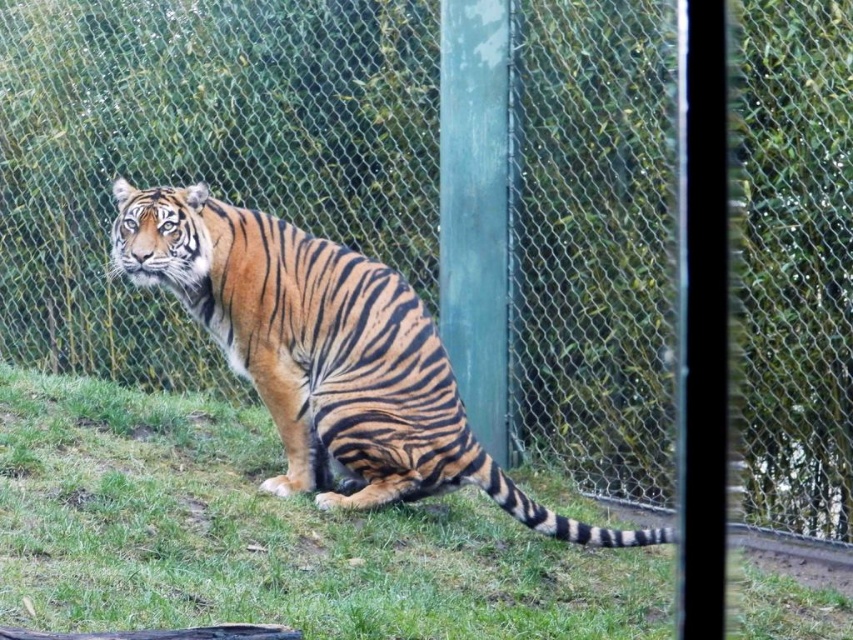
Question: Which point is farther from the camera taking this photo?

Choices:
 (A) (349, 413)
 (B) (276, 461)

Answer: (B)

Question: Is green grass at lower center closer to camera compared to orange-brown striped tiger at center?

Choices:
 (A) yes
 (B) no

Answer: (A)

Question: Considering the relative positions of green grass at lower center and orange-brown striped tiger at center in the image provided, where is green grass at lower center located with respect to orange-brown striped tiger at center?

Choices:
 (A) below
 (B) above

Answer: (A)

Question: Among these objects, which one is nearest to the camera?

Choices:
 (A) orange-brown striped tiger at center
 (B) green grass at lower center

Answer: (B)

Question: Can you confirm if green grass at lower center is positioned to the right of orange-brown striped tiger at center?

Choices:
 (A) no
 (B) yes

Answer: (A)